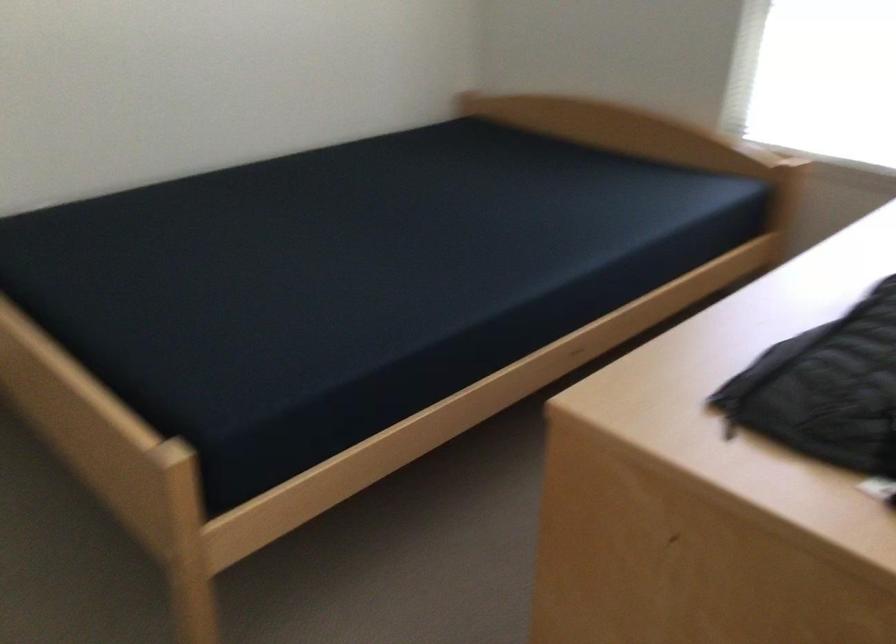
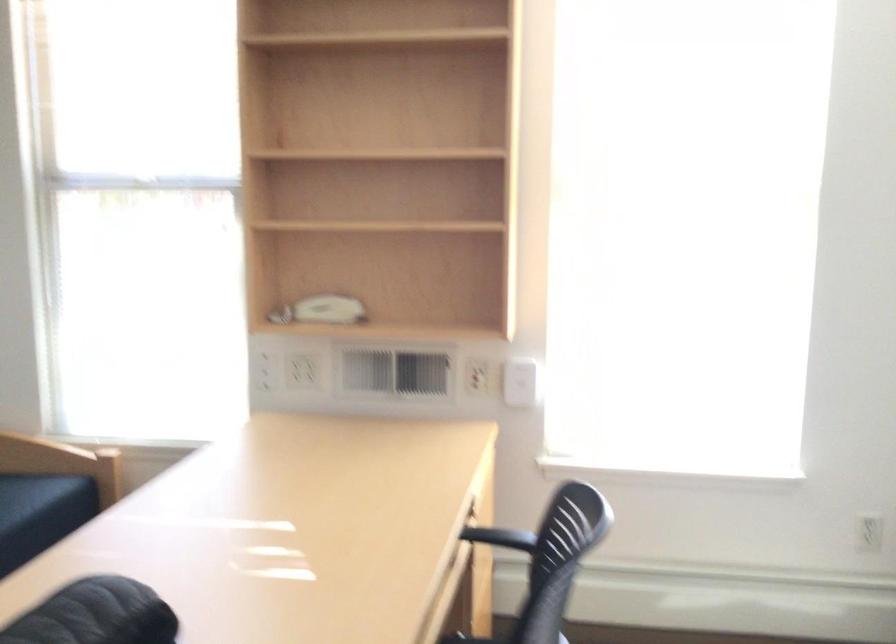
Question: The first image is from the beginning of the video and the second image is from the end. How did the camera likely rotate when shooting the video?

Choices:
 (A) Left
 (B) Right
 (C) Up
 (D) Down

Answer: (B)